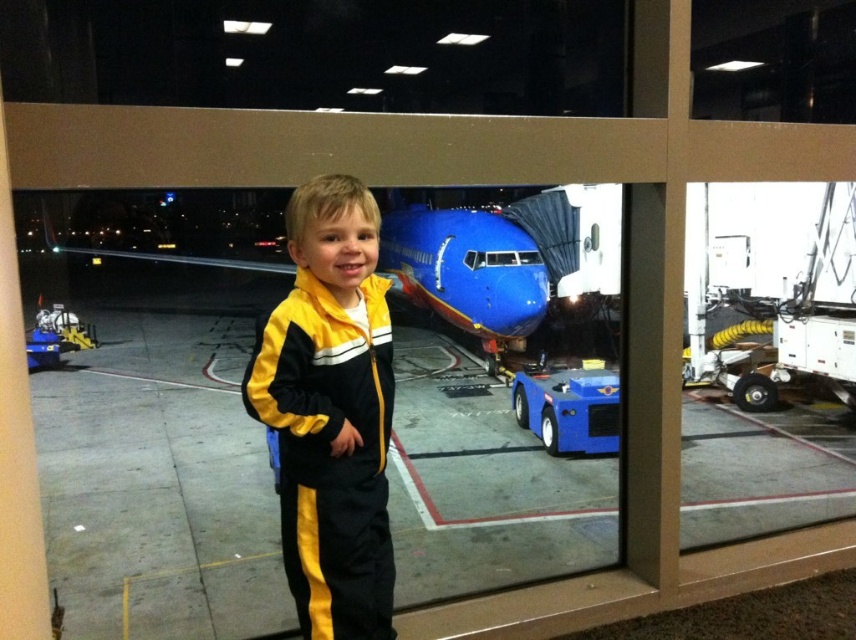
Is brushed metal tarmac at center thinner than yellow/black track suit at center?

No, brushed metal tarmac at center is not thinner than yellow/black track suit at center.

Between brushed metal tarmac at center and yellow/black track suit at center, which one appears on the left side from the viewer's perspective?

Positioned to the left is brushed metal tarmac at center.

In order to click on brushed metal tarmac at center in this screenshot , I will do `click(159, 483)`.

The image size is (856, 640). Identify the location of brushed metal tarmac at center. (159, 483).

Does yellow/black track suit at center have a larger size compared to blue glossy airplane at center?

Incorrect, yellow/black track suit at center is not larger than blue glossy airplane at center.

Looking at this image, does yellow/black track suit at center appear under blue glossy airplane at center?

Indeed, yellow/black track suit at center is positioned under blue glossy airplane at center.

Is point (358, 250) in front of point (385, 220)?

Yes, it is.

Image resolution: width=856 pixels, height=640 pixels. Identify the location of yellow/black track suit at center. (331, 412).

Does brushed metal tarmac at center have a lesser width compared to blue plastic toy car at center?

Incorrect, brushed metal tarmac at center's width is not less than blue plastic toy car at center's.

Locate an element on the screen. The image size is (856, 640). brushed metal tarmac at center is located at coordinates (159, 483).

Measure the distance between point (x=233, y=499) and camera.

A distance of 5.46 meters exists between point (x=233, y=499) and camera.

Find the location of a particular element. brushed metal tarmac at center is located at coordinates (159, 483).